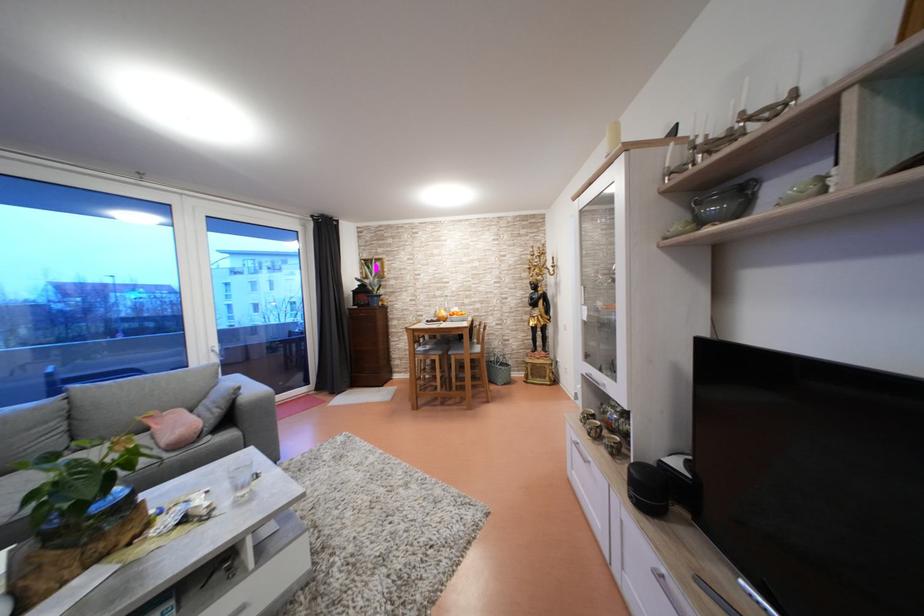
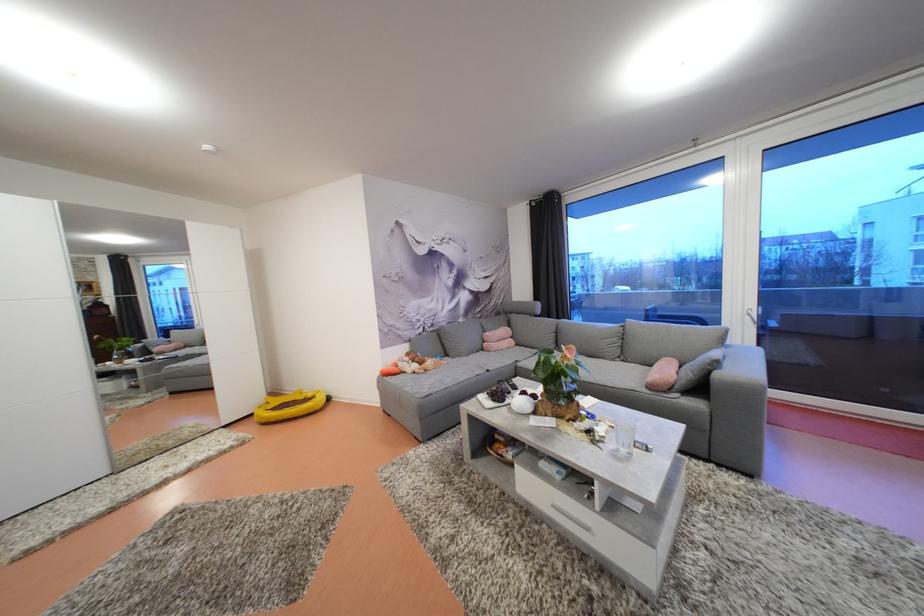
Question: The images are taken continuously from a first-person perspective. In which direction is your viewpoint rotating?

Choices:
 (A) Left
 (B) Right
 (C) Up
 (D) Down

Answer: (A)